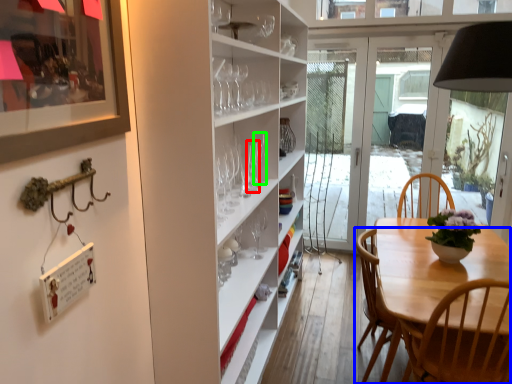
Question: Which is farther away from wine glass (highlighted by a red box)? chair (highlighted by a blue box) or wine glass (highlighted by a green box)?

Choices:
 (A) chair
 (B) wine glass

Answer: (A)